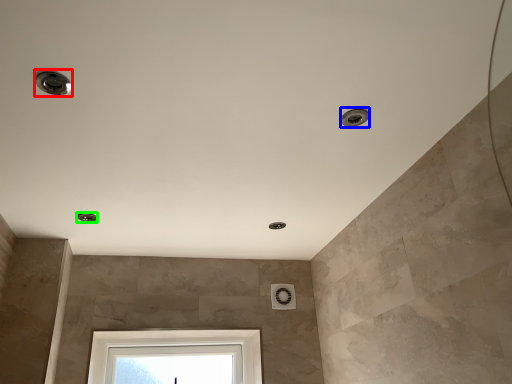
Question: Based on their relative distances, which object is farther from droplight (highlighted by a red box)? Choose from droplight (highlighted by a blue box) and droplight (highlighted by a green box).

Choices:
 (A) droplight
 (B) droplight

Answer: (B)